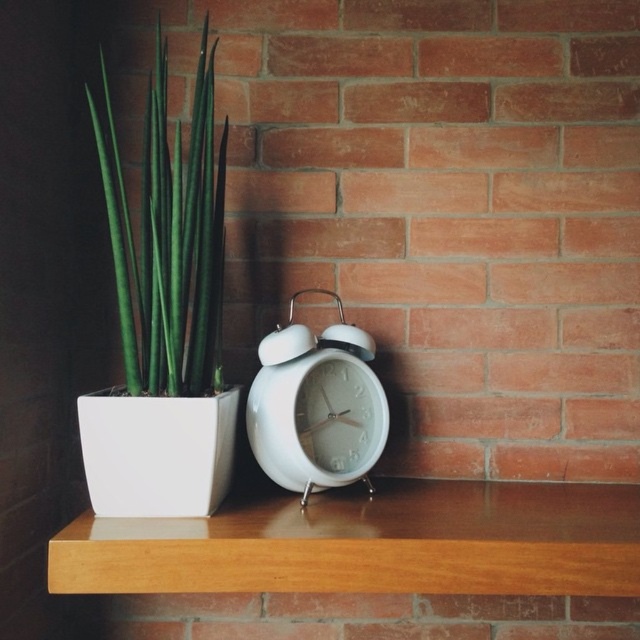
Based on the photo, you are standing in front of the brick wall with the wooden shelf. There is a white ceramic pot with a green snake plant and a white alarm clock on the shelf. Which object is located at the coordinate point [170,237]?

The point [170,237] indicates the green glossy plant at left.

Looking at this image, you are organizing a small space and want to place a new decorative item on the wooden shelf at center. Considering the green glossy plant at left is already there, what should you be cautious about regarding the shelf and plant?

The wooden shelf at center is shorter than the green glossy plant at left, so you should be cautious about the plant potentially overhanging the edge of the shelf and possibly tipping over if not secured properly.

Looking at this image, you are arranging items on a shelf and want to place a decorative item between the green glossy plant at left and the white glossy alarm clock at center. Based on their positions, where should you place the new item to ensure it is centered between them?

The new item should be placed to the right of the green glossy plant at left but to the left of the white glossy alarm clock at center, as the green glossy plant at left is positioned to the left of the white glossy alarm clock at center.